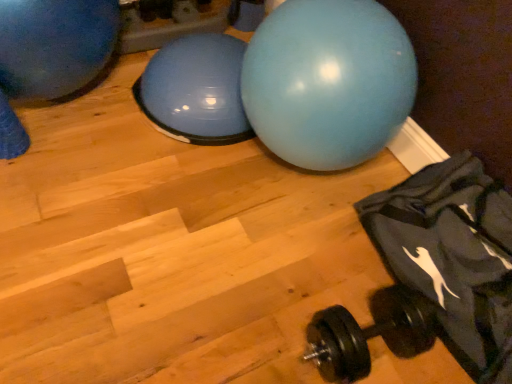
I want to click on dark gray fabric bean bag chair at lower right, so click(452, 257).

Locate an element on the screen. The image size is (512, 384). matte blue ball at center, the 2th ball from the left is located at coordinates (328, 81).

From their relative heights in the image, would you say blue rubber ball at upper left, placed as the first ball when sorted from left to right, is taller or shorter than dark gray fabric bean bag chair at lower right?

blue rubber ball at upper left, placed as the first ball when sorted from left to right, is taller than dark gray fabric bean bag chair at lower right.

There is a dark gray fabric bean bag chair at lower right. At what (x,y) coordinates should I click in order to perform the action: click on the 2nd ball above it (from the image's perspective). Please return your answer as a coordinate pair (x, y). Looking at the image, I should click on (54, 45).

Consider the image. How different are the orientations of blue rubber ball at upper left, placed as the first ball when sorted from left to right, and dark gray fabric bean bag chair at lower right in degrees?

The facing directions of blue rubber ball at upper left, placed as the first ball when sorted from left to right, and dark gray fabric bean bag chair at lower right are 85.8 degrees apart.

Does blue rubber ball at upper left, the 2th ball from the right, contain dark gray fabric bean bag chair at lower right?

Definitely not — dark gray fabric bean bag chair at lower right is not inside blue rubber ball at upper left, the 2th ball from the right.

Considering the sizes of blue rubber ball at upper left, the 2th ball from the right, and black rubber dumbbell at lower right in the image, is blue rubber ball at upper left, the 2th ball from the right, taller or shorter than black rubber dumbbell at lower right?

Clearly, blue rubber ball at upper left, the 2th ball from the right, is taller compared to black rubber dumbbell at lower right.

From the image's perspective, is blue rubber ball at upper left, placed as the first ball when sorted from left to right, located beneath black rubber dumbbell at lower right?

No.

Is blue rubber ball at upper left, the 2th ball from the right, oriented towards black rubber dumbbell at lower right?

Yes, blue rubber ball at upper left, the 2th ball from the right, is oriented towards black rubber dumbbell at lower right.

Is matte blue ball at center, the 2th ball from the left, in contact with blue rubber ball at upper left, the 2th ball from the right?

matte blue ball at center, the 2th ball from the left, is not next to blue rubber ball at upper left, the 2th ball from the right, and they're not touching.

What's the angular difference between matte blue ball at center, the 2th ball from the left, and blue rubber ball at upper left, placed as the first ball when sorted from left to right,'s facing directions?

The facing directions of matte blue ball at center, the 2th ball from the left, and blue rubber ball at upper left, placed as the first ball when sorted from left to right, are 90 degrees apart.

Considering the points (323, 46) and (59, 0), which point is in front, point (323, 46) or point (59, 0)?

The point (323, 46) is closer to the camera.

Between matte blue ball at center, the 2th ball from the left, and blue rubber ball at upper left, placed as the first ball when sorted from left to right, which one appears on the left side from the viewer's perspective?

blue rubber ball at upper left, placed as the first ball when sorted from left to right.

Which point is more distant from viewer, [377,107] or [504,250]?

The point [377,107] is farther.

Which object is closer to the camera, matte blue ball at center, which is counted as the 1th ball, starting from the right, or dark gray fabric bean bag chair at lower right?

dark gray fabric bean bag chair at lower right is closer to the camera.

Who is bigger, matte blue ball at center, the 2th ball from the left, or dark gray fabric bean bag chair at lower right?

matte blue ball at center, the 2th ball from the left.

Which ball is the 1st one when counting from the left side of the dark gray fabric bean bag chair at lower right? Please provide its 2D coordinates.

[(328, 81)]

Who is taller, black rubber dumbbell at lower right or dark gray fabric bean bag chair at lower right?

dark gray fabric bean bag chair at lower right is taller.

Based on their positions, is black rubber dumbbell at lower right located to the left or right of dark gray fabric bean bag chair at lower right?

Based on their positions, black rubber dumbbell at lower right is located to the left of dark gray fabric bean bag chair at lower right.

Is black rubber dumbbell at lower right smaller than dark gray fabric bean bag chair at lower right?

Yes.

Who is shorter, black rubber dumbbell at lower right or blue rubber ball at upper left, placed as the first ball when sorted from left to right?

black rubber dumbbell at lower right.

Is blue rubber ball at upper left, the 2th ball from the right, at the back of black rubber dumbbell at lower right?

black rubber dumbbell at lower right does not have its back to blue rubber ball at upper left, the 2th ball from the right.

From the image's perspective, does black rubber dumbbell at lower right appear higher than blue rubber ball at upper left, the 2th ball from the right?

No, from the image's perspective, black rubber dumbbell at lower right is not over blue rubber ball at upper left, the 2th ball from the right.

Which of these two, black rubber dumbbell at lower right or blue rubber ball at upper left, placed as the first ball when sorted from left to right, is thinner?

With smaller width is black rubber dumbbell at lower right.

Is black rubber dumbbell at lower right outside of matte blue ball at center, which is counted as the 1th ball, starting from the right?

Yes, black rubber dumbbell at lower right is located beyond the bounds of matte blue ball at center, which is counted as the 1th ball, starting from the right.

Is the position of black rubber dumbbell at lower right less distant than that of matte blue ball at center, which is counted as the 1th ball, starting from the right?

Yes, the depth of black rubber dumbbell at lower right is less than that of matte blue ball at center, which is counted as the 1th ball, starting from the right.

Which object is positioned more to the right, black rubber dumbbell at lower right or matte blue ball at center, which is counted as the 1th ball, starting from the right?

From the viewer's perspective, black rubber dumbbell at lower right appears more on the right side.

From the image's perspective, which one is positioned lower, black rubber dumbbell at lower right or matte blue ball at center, the 2th ball from the left?

From the image's view, black rubber dumbbell at lower right is below.

Identify the location of the 2nd ball above the dark gray fabric bean bag chair at lower right (from the image's perspective). This screenshot has width=512, height=384. (54, 45).

Locate an element on the screen. dumbbell in front of the blue rubber ball at upper left, the 2th ball from the right is located at coordinates (369, 334).

Which object lies further to the anchor point black rubber dumbbell at lower right, blue rubber ball at upper left, placed as the first ball when sorted from left to right, or matte blue ball at center, which is counted as the 1th ball, starting from the right?

blue rubber ball at upper left, placed as the first ball when sorted from left to right.

When comparing their distances from matte blue ball at center, which is counted as the 1th ball, starting from the right, does black rubber dumbbell at lower right or blue rubber ball at upper left, the 2th ball from the right, seem further?

blue rubber ball at upper left, the 2th ball from the right.

Considering their positions, is dark gray fabric bean bag chair at lower right positioned further to blue rubber ball at upper left, the 2th ball from the right, than matte blue ball at center, which is counted as the 1th ball, starting from the right?

Among the two, dark gray fabric bean bag chair at lower right is located further to blue rubber ball at upper left, the 2th ball from the right.

Considering their positions, is dark gray fabric bean bag chair at lower right positioned further to black rubber dumbbell at lower right than blue rubber ball at upper left, the 2th ball from the right?

blue rubber ball at upper left, the 2th ball from the right.

Which object lies nearer to the anchor point blue rubber ball at upper left, the 2th ball from the right, black rubber dumbbell at lower right or matte blue ball at center, the 2th ball from the left?

matte blue ball at center, the 2th ball from the left, is positioned closer to the anchor blue rubber ball at upper left, the 2th ball from the right.

Estimate the real-world distances between objects in this image. Which object is further from dark gray fabric bean bag chair at lower right, blue rubber ball at upper left, the 2th ball from the right, or black rubber dumbbell at lower right?

blue rubber ball at upper left, the 2th ball from the right, is further to dark gray fabric bean bag chair at lower right.

Estimate the real-world distances between objects in this image. Which object is closer to black rubber dumbbell at lower right, matte blue ball at center, which is counted as the 1th ball, starting from the right, or dark gray fabric bean bag chair at lower right?

The object closer to black rubber dumbbell at lower right is dark gray fabric bean bag chair at lower right.

Considering their positions, is matte blue ball at center, which is counted as the 1th ball, starting from the right, positioned further to blue rubber ball at upper left, the 2th ball from the right, than black rubber dumbbell at lower right?

black rubber dumbbell at lower right.

What are the coordinates of `ball situated between blue rubber ball at upper left, the 2th ball from the right, and black rubber dumbbell at lower right from left to right` in the screenshot? It's located at (328, 81).

At what (x,y) coordinates should I click in order to perform the action: click on ball between blue rubber ball at upper left, the 2th ball from the right, and dark gray fabric bean bag chair at lower right. Please return your answer as a coordinate pair (x, y). Looking at the image, I should click on click(x=328, y=81).

Locate an element on the screen. The image size is (512, 384). dumbbell located between blue rubber ball at upper left, the 2th ball from the right, and dark gray fabric bean bag chair at lower right in the left-right direction is located at coordinates (369, 334).

Find the location of a particular element. The image size is (512, 384). bean bag chair between matte blue ball at center, which is counted as the 1th ball, starting from the right, and black rubber dumbbell at lower right vertically is located at coordinates (452, 257).